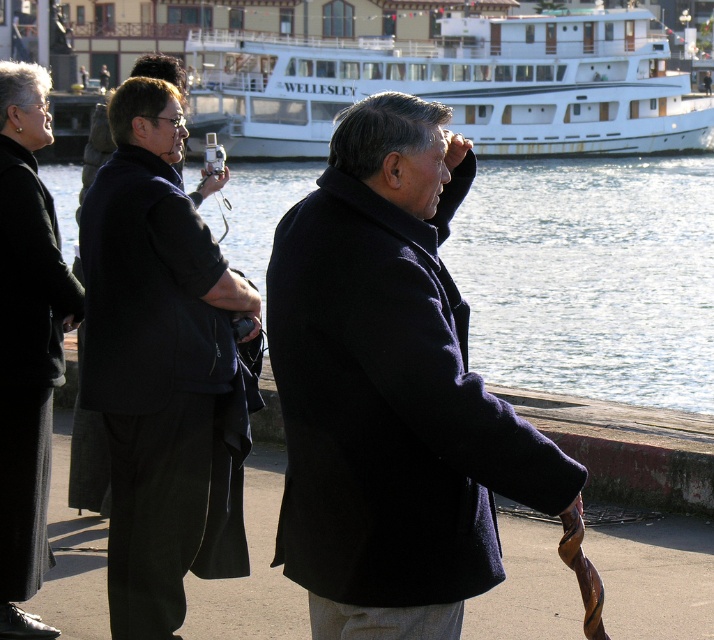
You are a photographer trying to capture a group photo of the people on the waterfront promenade. You notice two coats in the scene, the matte black coat at center and the black wool coat at left. Which coat should you focus on if you want to include the larger one in your shot?

The matte black coat at center is larger in size compared to the black wool coat at left, so you should focus on the matte black coat at center to include the larger one in your shot.